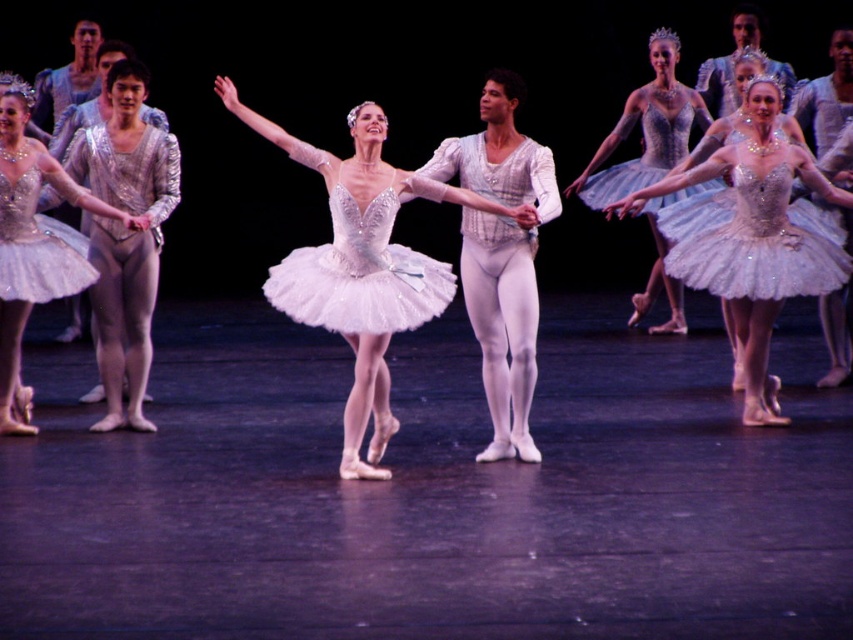
You are a stagehand looking at the stage setup. You need to adjust the lighting to highlight the sparkling silver tutu at center and the matte silver tutu at left. Since the stage floor is dark, which tutu will be more visible from the audience perspective?

The sparkling silver tutu at center will be more visible from the audience perspective because it is in front of the matte silver tutu at left.

Looking at this image, you are a stagehand observing the ballet performance. You notice two tutus on stage. Which one is positioned to the left of the other? The shiny silver tutu at center and the sparkling silver tutu at center are both visible. Please identify their positions relative to each other.

The shiny silver tutu at center is positioned to the left of the sparkling silver tutu at center.

In the scene shown: You are a stagehand who needs to adjust the lighting for the ballet performance. You notice two tutus on stage, the shiny silver tutu at center and the sparkling silver tutu at center. Which one is closer to the front of the stage?

The shiny silver tutu at center is closer to the front of the stage because it is in front of the sparkling silver tutu at center.